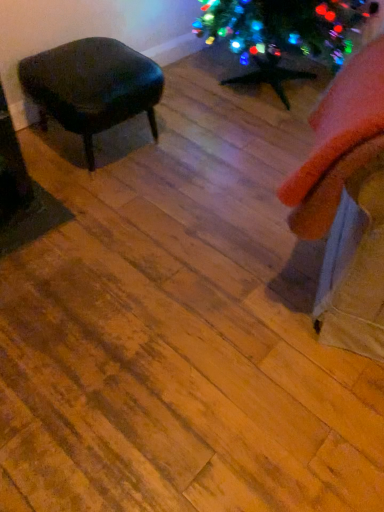
Question: Looking at their shapes, would you say orange fabric swivel chair at right is wider or thinner than matte black stool at left?

Choices:
 (A) thin
 (B) wide

Answer: (A)

Question: Considering the positions of orange fabric swivel chair at right and matte black stool at left in the image, is orange fabric swivel chair at right bigger or smaller than matte black stool at left?

Choices:
 (A) big
 (B) small

Answer: (B)

Question: Does point (324, 102) appear closer or farther from the camera than point (117, 53)?

Choices:
 (A) farther
 (B) closer

Answer: (B)

Question: Is matte black stool at left situated inside orange fabric swivel chair at right or outside?

Choices:
 (A) inside
 (B) outside

Answer: (B)

Question: Is matte black stool at left taller or shorter than orange fabric swivel chair at right?

Choices:
 (A) tall
 (B) short

Answer: (B)

Question: Does point (84, 72) appear closer or farther from the camera than point (364, 53)?

Choices:
 (A) closer
 (B) farther

Answer: (B)

Question: Looking at the image, does matte black stool at left seem bigger or smaller compared to orange fabric swivel chair at right?

Choices:
 (A) big
 (B) small

Answer: (A)